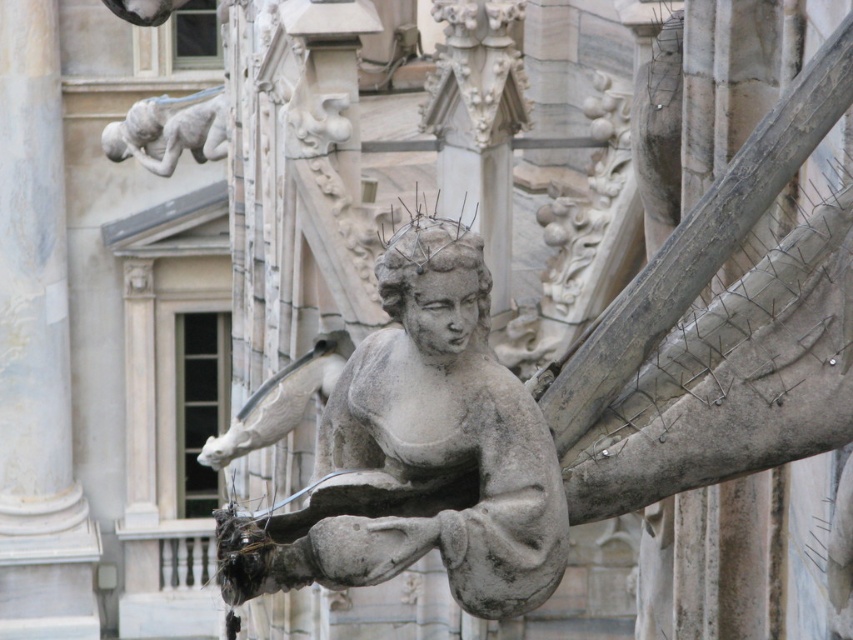
Is point (476, 243) closer to viewer compared to point (155, 120)?

That is True.

Does gray stone angel at center have a lesser height compared to gray stone gargoyle at upper left?

No, gray stone angel at center is not shorter than gray stone gargoyle at upper left.

Locate an element on the screen. The height and width of the screenshot is (640, 853). gray stone angel at center is located at coordinates (419, 452).

Locate an element on the screen. gray stone angel at center is located at coordinates 419,452.

Who is more distant from viewer, (x=33, y=580) or (x=119, y=141)?

The point (x=33, y=580) is behind.

Is white marble pillar at center further to the viewer compared to gray stone gargoyle at upper left?

Yes, white marble pillar at center is further from the viewer.

Between point (33, 582) and point (144, 138), which one is positioned in front?

Point (144, 138)

Where is `white marble pillar at center`? white marble pillar at center is located at coordinates (36, 348).

Is gray stone angel at center further to the viewer compared to white marble pillar at center?

No, gray stone angel at center is in front of white marble pillar at center.

Can you confirm if gray stone angel at center is positioned below white marble pillar at center?

Indeed, gray stone angel at center is positioned under white marble pillar at center.

Identify the location of gray stone angel at center. (419, 452).

This screenshot has height=640, width=853. I want to click on gray stone angel at center, so click(x=419, y=452).